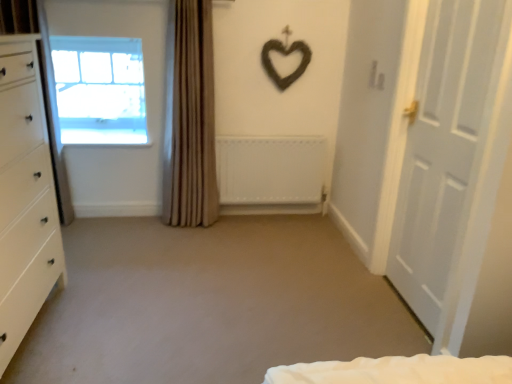
Identify the location of vacant area to the left of white matte door at right. (345, 299).